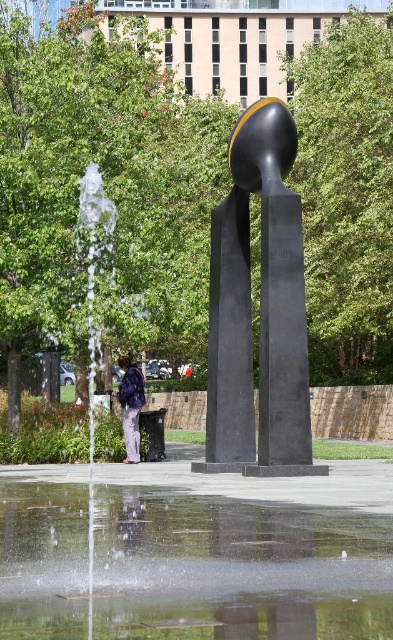
Question: Is glistening water at fountain center above black polished stone sculpture at center?

Choices:
 (A) no
 (B) yes

Answer: (A)

Question: Which of the following is the closest to the observer?

Choices:
 (A) (218, 230)
 (B) (139, 412)
 (C) (82, 637)

Answer: (C)

Question: Where is glistening water at fountain center located in relation to purple fabric backpack at lower left in the image?

Choices:
 (A) below
 (B) above

Answer: (A)

Question: Which object is the closest to the black polished stone sculpture at center?

Choices:
 (A) glistening water at fountain center
 (B) purple fabric backpack at lower left

Answer: (B)

Question: Is glistening water at fountain center bigger than black polished stone sculpture at center?

Choices:
 (A) yes
 (B) no

Answer: (A)

Question: Which is nearer to the black polished stone sculpture at center?

Choices:
 (A) purple fabric backpack at lower left
 (B) glistening water at fountain center

Answer: (A)